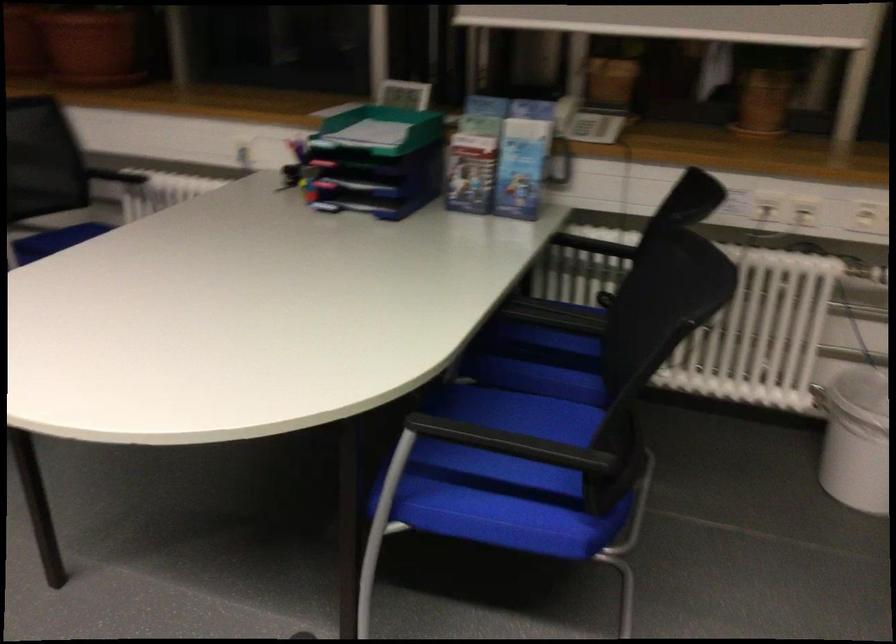
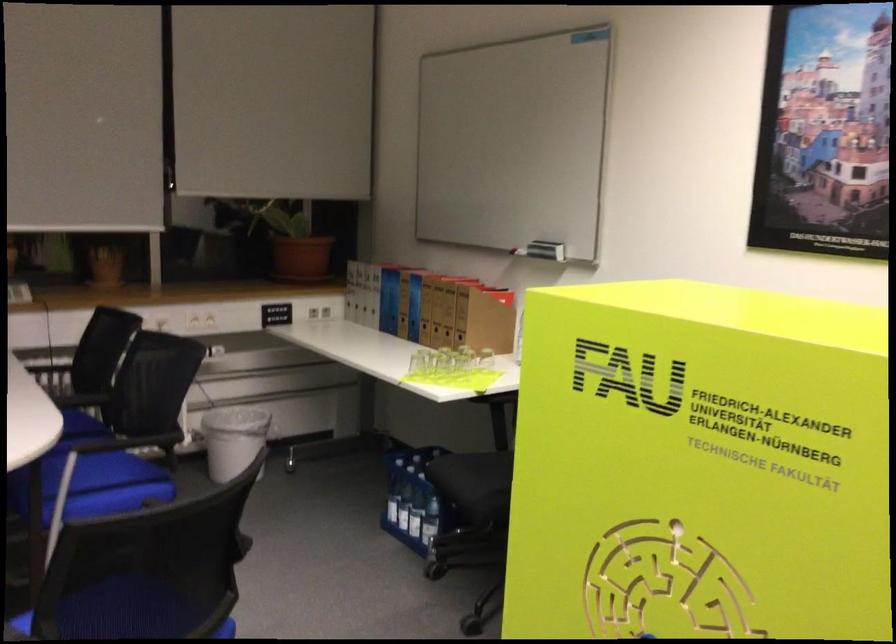
Where in the second image is the point corresponding to point (504, 458) from the first image?

(95, 485)